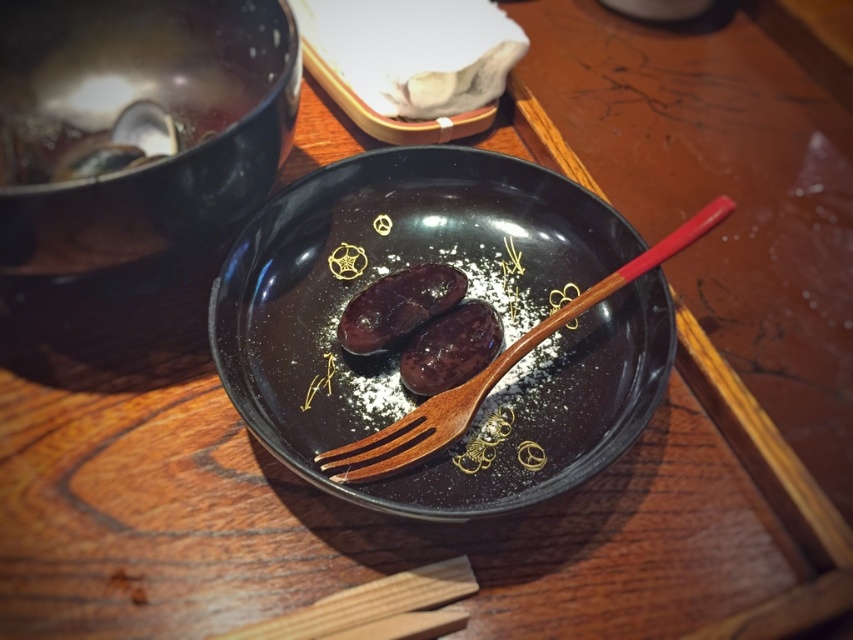
Question: Can you confirm if black matte plate at center is thinner than shiny dark brown meat at center?

Choices:
 (A) no
 (B) yes

Answer: (A)

Question: Which point is closer to the camera taking this photo?

Choices:
 (A) (345, 593)
 (B) (398, 324)
 (C) (537, 260)

Answer: (A)

Question: Which is nearer to the wooden chopsticks at lower center?

Choices:
 (A) glossy ceramic bowl at upper center
 (B) shiny dark brown dessert at center
 (C) black matte plate at center

Answer: (B)

Question: Which point is farther from the camera taking this photo?

Choices:
 (A) (424, 604)
 (B) (556, 349)
 (C) (384, 321)

Answer: (B)

Question: Is wooden chopsticks at lower center to the right of shiny dark brown dessert at center from the viewer's perspective?

Choices:
 (A) yes
 (B) no

Answer: (B)

Question: From the image, what is the correct spatial relationship of black matte plate at center in relation to wooden chopsticks at lower center?

Choices:
 (A) left
 (B) right

Answer: (B)